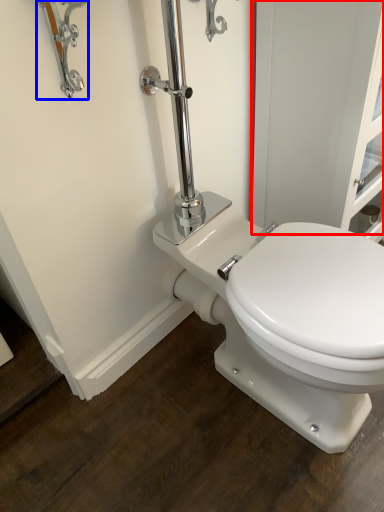
Question: Which point is closer to the camera, screen door (highlighted by a red box) or faucet (highlighted by a blue box)?

Choices:
 (A) screen door
 (B) faucet

Answer: (B)